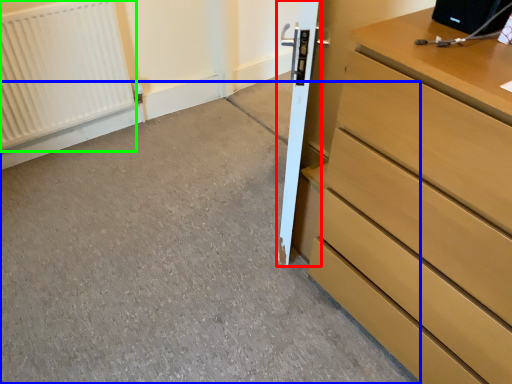
Question: Which is nearer to the door (highlighted by a red box)? concrete (highlighted by a blue box) or radiator (highlighted by a green box).

Choices:
 (A) concrete
 (B) radiator

Answer: (A)